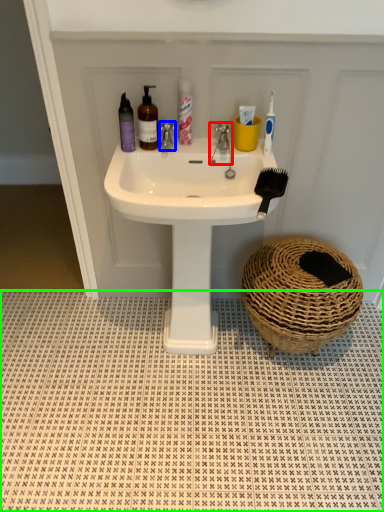
Question: Estimate the real-world distances between objects in this image. Which object is farther from tap (highlighted by a red box), tap (highlighted by a blue box) or tile (highlighted by a green box)?

Choices:
 (A) tap
 (B) tile

Answer: (B)